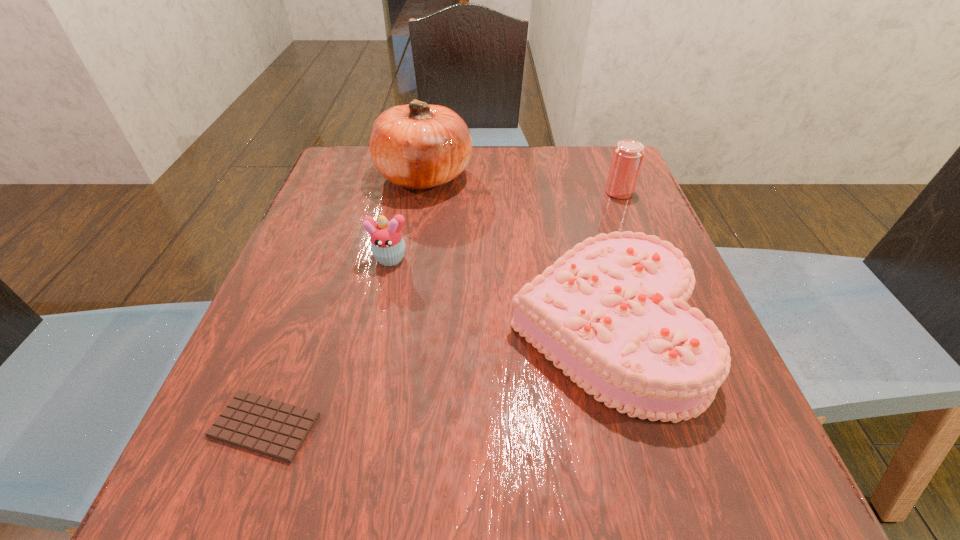
The width and height of the screenshot is (960, 540). Find the location of `the tallest object`. the tallest object is located at coordinates (418, 145).

This screenshot has width=960, height=540. Find the location of `beer can`. beer can is located at coordinates (628, 154).

Where is `cupcake`? cupcake is located at coordinates (387, 243).

Locate an element on the screen. The width and height of the screenshot is (960, 540). cake is located at coordinates (611, 313).

Identify the location of chocolate bar. (273, 428).

I want to click on free location located on the front of the tallest object, so click(x=401, y=316).

Where is `vacant space located on the back of the beer can`? vacant space located on the back of the beer can is located at coordinates (607, 162).

What are the coordinates of `free location located 0.110m on the face of the cupcake` in the screenshot? It's located at (378, 312).

Locate an element on the screen. vacant space located 0.130m on the front of the cake is located at coordinates (653, 524).

Image resolution: width=960 pixels, height=540 pixels. Identify the location of vacant space located on the right of the chocolate bar. (515, 426).